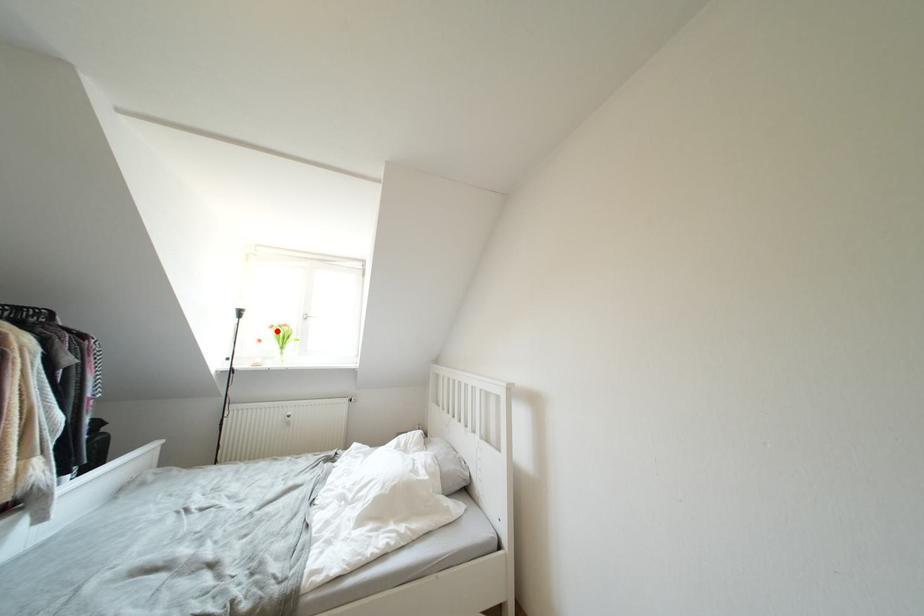
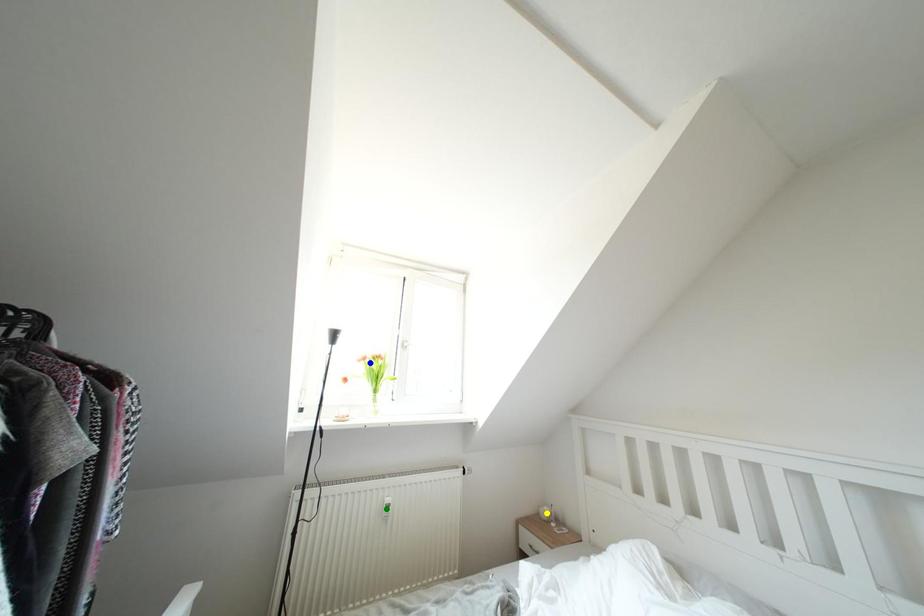
Question: I am providing you with two images of the same scene from different viewpoints. A red point is marked on the first image. You are given multiple points on the second image. Which point in image 2 represents the same 3d spot as the red point in image 1?

Choices:
 (A) yellow point
 (B) blue point
 (C) green point

Answer: (B)